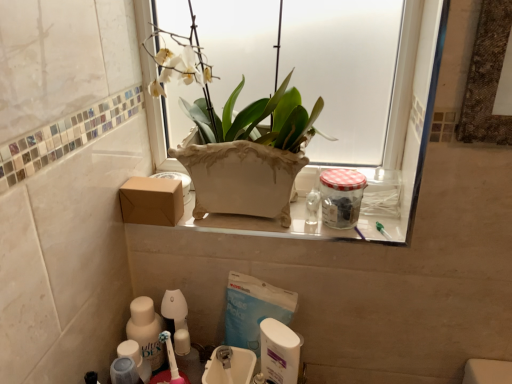
This screenshot has height=384, width=512. In order to click on white plastic container at lower center, positioned as the second cleaning product in left-to-right order in this screenshot , I will do `click(279, 352)`.

Image resolution: width=512 pixels, height=384 pixels. What do you see at coordinates (152, 201) in the screenshot? I see `brown cardboard box at lower left` at bounding box center [152, 201].

Locate an element on the screen. The image size is (512, 384). white plastic sink at lower center, which is the first sink from back to front is located at coordinates (279, 352).

In order to face clear glass jar at upper right, should I rotate leftwards or rightwards?

Rotate your view right by about 11.768°.

Describe the element at coordinates (147, 330) in the screenshot. I see `translucent plastic bottle at lower left, which is the 1th cleaning product in left-to-right order` at that location.

The image size is (512, 384). I want to click on white glossy ceramic vase at upper center, so click(x=246, y=146).

Where is `white glossy sink at lower center, arranged as the first sink when viewed from the front`? white glossy sink at lower center, arranged as the first sink when viewed from the front is located at coordinates (229, 366).

Locate an element on the screen. white plastic container at lower center, positioned as the second cleaning product in left-to-right order is located at coordinates (279, 352).

Based on the photo, are translucent plastic bottle at lower left, which is the 1th cleaning product in left-to-right order, and clear glass jar at upper right making contact?

translucent plastic bottle at lower left, which is the 1th cleaning product in left-to-right order, and clear glass jar at upper right are not in contact.

Could you tell me if translucent plastic bottle at lower left, which is the 1th cleaning product in left-to-right order, is facing clear glass jar at upper right?

No, translucent plastic bottle at lower left, which is the 1th cleaning product in left-to-right order, is not turned towards clear glass jar at upper right.

From the image's perspective, would you say translucent plastic bottle at lower left, the 2th cleaning product positioned from the right, is shown under clear glass jar at upper right?

Yes.

Is white glossy sink at lower center, which is counted as the second sink, starting from the back, placed right next to white plastic sink at lower center, which ranks as the 2th sink in front-to-back order?

Yes.

Does white glossy sink at lower center, arranged as the first sink when viewed from the front, come behind white plastic sink at lower center, which ranks as the 2th sink in front-to-back order?

No, the depth of white glossy sink at lower center, arranged as the first sink when viewed from the front, is less than that of white plastic sink at lower center, which ranks as the 2th sink in front-to-back order.

From the image's perspective, is white glossy sink at lower center, which is counted as the second sink, starting from the back, located beneath white plastic sink at lower center, which ranks as the 2th sink in front-to-back order?

Yes, from the image's perspective, white glossy sink at lower center, which is counted as the second sink, starting from the back, is beneath white plastic sink at lower center, which ranks as the 2th sink in front-to-back order.

Which of these two, white glossy sink at lower center, arranged as the first sink when viewed from the front, or white plastic sink at lower center, which is the first sink from back to front, is thinner?

Thinner between the two is white plastic sink at lower center, which is the first sink from back to front.

Considering the positions of point (283, 369) and point (336, 186), is point (283, 369) closer or farther from the camera than point (336, 186)?

Point (283, 369).

Which of these two, white plastic container at lower center, the first cleaning product from the right, or clear glass jar at upper right, is thinner?

With smaller width is white plastic container at lower center, the first cleaning product from the right.

Which object is further away from the camera taking this photo, white plastic container at lower center, the first cleaning product from the right, or clear glass jar at upper right?

clear glass jar at upper right.

Could you tell me if white plastic container at lower center, the first cleaning product from the right, is facing clear glass jar at upper right?

No, white plastic container at lower center, the first cleaning product from the right, is not facing towards clear glass jar at upper right.

Is white glossy ceramic vase at upper center surrounding white glossy sink at lower center, arranged as the first sink when viewed from the front?

No, white glossy sink at lower center, arranged as the first sink when viewed from the front, is located outside of white glossy ceramic vase at upper center.

Does white glossy ceramic vase at upper center have a greater width compared to white glossy sink at lower center, arranged as the first sink when viewed from the front?

Yes.

Which is in front, point (270, 131) or point (238, 369)?

Positioned in front is point (270, 131).

Is white glossy ceramic vase at upper center shorter than white glossy sink at lower center, which is counted as the second sink, starting from the back?

In fact, white glossy ceramic vase at upper center may be taller than white glossy sink at lower center, which is counted as the second sink, starting from the back.

Considering the relative sizes of clear glass jar at upper right and translucent plastic bottle at lower left, the 2th cleaning product positioned from the right, in the image provided, is clear glass jar at upper right shorter than translucent plastic bottle at lower left, the 2th cleaning product positioned from the right,?

Correct, clear glass jar at upper right is not as tall as translucent plastic bottle at lower left, the 2th cleaning product positioned from the right.

Is clear glass jar at upper right facing towards translucent plastic bottle at lower left, the 2th cleaning product positioned from the right?

No, clear glass jar at upper right is not turned towards translucent plastic bottle at lower left, the 2th cleaning product positioned from the right.

From the image's perspective, is clear glass jar at upper right on translucent plastic bottle at lower left, which is the 1th cleaning product in left-to-right order?

Correct, clear glass jar at upper right appears higher than translucent plastic bottle at lower left, which is the 1th cleaning product in left-to-right order, in the image.

Would you say translucent plastic bottle at lower left, which is the 1th cleaning product in left-to-right order, is to the left or to the right of white plastic sink at lower center, which ranks as the 2th sink in front-to-back order, in the picture?

Clearly, translucent plastic bottle at lower left, which is the 1th cleaning product in left-to-right order, is on the left of white plastic sink at lower center, which ranks as the 2th sink in front-to-back order, in the image.

How many degrees apart are the facing directions of translucent plastic bottle at lower left, which is the 1th cleaning product in left-to-right order, and white plastic sink at lower center, which ranks as the 2th sink in front-to-back order?

90.9 degrees.

Considering the relative sizes of translucent plastic bottle at lower left, the 2th cleaning product positioned from the right, and white plastic sink at lower center, which ranks as the 2th sink in front-to-back order, in the image provided, is translucent plastic bottle at lower left, the 2th cleaning product positioned from the right, smaller than white plastic sink at lower center, which ranks as the 2th sink in front-to-back order,?

Yes.

Does point (141, 310) come farther from viewer compared to point (279, 345)?

Yes, it is.

From the image's perspective, is white plastic sink at lower center, which is the first sink from back to front, above white glossy sink at lower center, which is counted as the second sink, starting from the back?

Correct, white plastic sink at lower center, which is the first sink from back to front, appears higher than white glossy sink at lower center, which is counted as the second sink, starting from the back, in the image.

How far apart are white plastic sink at lower center, which is the first sink from back to front, and white glossy sink at lower center, arranged as the first sink when viewed from the front?

1.81 inches.

Are white plastic sink at lower center, which is the first sink from back to front, and white glossy sink at lower center, arranged as the first sink when viewed from the front, located far from each other?

Actually, white plastic sink at lower center, which is the first sink from back to front, and white glossy sink at lower center, arranged as the first sink when viewed from the front, are a little close together.

Could white glossy sink at lower center, arranged as the first sink when viewed from the front, be considered to be inside white plastic sink at lower center, which is the first sink from back to front?

Actually, white glossy sink at lower center, arranged as the first sink when viewed from the front, is outside white plastic sink at lower center, which is the first sink from back to front.

Where is `the 2nd cleaning product to the left of the clear glass jar at upper right, counting from the anchor's position`? the 2nd cleaning product to the left of the clear glass jar at upper right, counting from the anchor's position is located at coordinates (147, 330).

The height and width of the screenshot is (384, 512). Identify the location of sink below the white plastic sink at lower center, which ranks as the 2th sink in front-to-back order (from the image's perspective). tap(229, 366).

Considering their positions, is white plastic sink at lower center, which ranks as the 2th sink in front-to-back order, positioned further to white glossy sink at lower center, arranged as the first sink when viewed from the front, than translucent plastic bottle at lower left, which is the 1th cleaning product in left-to-right order?

Based on the image, translucent plastic bottle at lower left, which is the 1th cleaning product in left-to-right order, appears to be further to white glossy sink at lower center, arranged as the first sink when viewed from the front.

Estimate the real-world distances between objects in this image. Which object is further from white glossy sink at lower center, which is counted as the second sink, starting from the back, clear glass jar at upper right or white plastic sink at lower center, which ranks as the 2th sink in front-to-back order?

clear glass jar at upper right.

Based on their spatial positions, is brown cardboard box at lower left or clear glass jar at upper right further from translucent plastic bottle at lower left, the 2th cleaning product positioned from the right?

clear glass jar at upper right.

When comparing their distances from clear glass jar at upper right, does white plastic container at lower center, positioned as the second cleaning product in left-to-right order, or white glossy ceramic vase at upper center seem further?

white plastic container at lower center, positioned as the second cleaning product in left-to-right order, is positioned further to the anchor clear glass jar at upper right.

Estimate the real-world distances between objects in this image. Which object is closer to brown cardboard box at lower left, white plastic container at lower center, positioned as the second cleaning product in left-to-right order, or clear glass jar at upper right?

white plastic container at lower center, positioned as the second cleaning product in left-to-right order, lies closer to brown cardboard box at lower left than the other object.

Estimate the real-world distances between objects in this image. Which object is further from white plastic container at lower center, positioned as the second cleaning product in left-to-right order, clear glass jar at upper right or white plastic sink at lower center, which ranks as the 2th sink in front-to-back order?

The object further to white plastic container at lower center, positioned as the second cleaning product in left-to-right order, is clear glass jar at upper right.

Consider the image. Looking at the image, which one is located further to brown cardboard box at lower left, translucent plastic bottle at lower left, the 2th cleaning product positioned from the right, or white glossy ceramic vase at upper center?

translucent plastic bottle at lower left, the 2th cleaning product positioned from the right, is further to brown cardboard box at lower left.

Considering their positions, is white glossy sink at lower center, arranged as the first sink when viewed from the front, positioned closer to white plastic container at lower center, positioned as the second cleaning product in left-to-right order, than white glossy ceramic vase at upper center?

white glossy sink at lower center, arranged as the first sink when viewed from the front, is closer to white plastic container at lower center, positioned as the second cleaning product in left-to-right order.

The image size is (512, 384). I want to click on cardboard box between white glossy ceramic vase at upper center and white plastic sink at lower center, which ranks as the 2th sink in front-to-back order, in the vertical direction, so click(152, 201).

The height and width of the screenshot is (384, 512). I want to click on mouthwash between brown cardboard box at lower left and white glossy sink at lower center, which is counted as the second sink, starting from the back, in the up-down direction, so click(x=341, y=197).

Identify the location of cardboard box between white glossy ceramic vase at upper center and white glossy sink at lower center, arranged as the first sink when viewed from the front, in the vertical direction. This screenshot has height=384, width=512. (152, 201).

Locate an element on the screen. This screenshot has width=512, height=384. sink located between translucent plastic bottle at lower left, the 2th cleaning product positioned from the right, and white plastic sink at lower center, which ranks as the 2th sink in front-to-back order, in the left-right direction is located at coordinates 229,366.